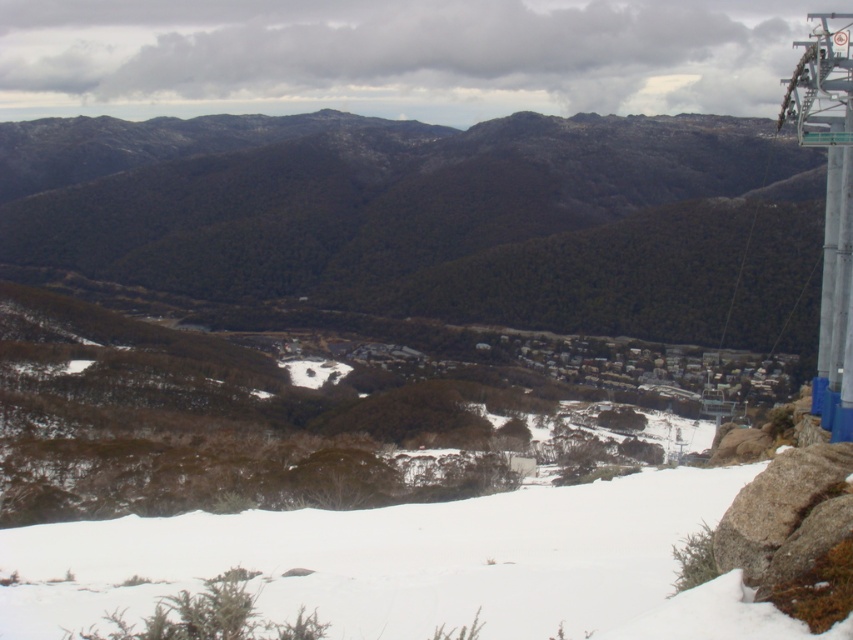
Based on the scene description, where is the green matte mountain at center located in terms of coordinates?

The green matte mountain at center is located at point coordinates of (438, 216).

You are a hiker planning to descend from the green matte mountain at center to the white snow at lower center. Considering their heights, which direction should you head to reach the lower elevation?

The green matte mountain at center is much taller than the white snow at lower center, so you should head downward towards the white snow at lower center to reach the lower elevation.

You are standing at the top of the slope and want to walk to the town in the valley. Which direction should you head relative to the green matte mountain at center and the white snow at lower center?

You should head to the right of the green matte mountain at center because the white snow at lower center is located to its left, and the town is in the valley beyond the snow.